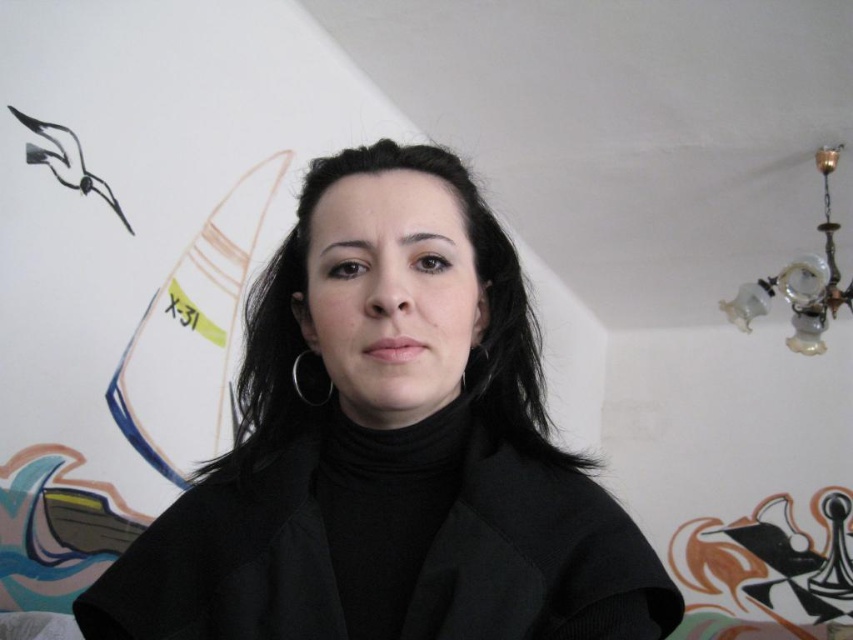
What are the coordinates of the black matte jacket at center?

The black matte jacket at center is located at coordinates point (x=389, y=449).

You are standing in the room and want to place a small sticker on the wall between the two points labeled as point (157, 554) and point (103, 579). Which point is closer to you so you can reach it easily?

Point (157, 554) is closer to the viewer than point (103, 579), so you can reach it easily.

Looking at this image, you are trying to decide which item to take from the center of the image. The black matte jacket at center and the black woolen coat at center are both at the center. Which one is physically closer to you?

The black matte jacket at center is closer to the viewer than the black woolen coat at center.